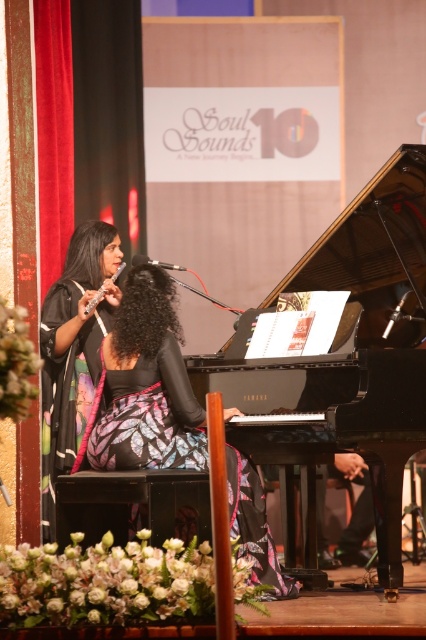
Question: In this image, where is black polished piano at center located relative to matte silver flute at center?

Choices:
 (A) below
 (B) above

Answer: (A)

Question: Which is nearer to the black polished piano at center?

Choices:
 (A) black satin dress at left
 (B) floral dress at center
 (C) matte silver flute at center

Answer: (B)

Question: Is floral dress at center behind matte silver flute at center?

Choices:
 (A) no
 (B) yes

Answer: (A)

Question: Estimate the real-world distances between objects in this image. Which object is closer to the black polished piano at center?

Choices:
 (A) matte silver flute at center
 (B) floral dress at center

Answer: (B)

Question: Can you confirm if black satin dress at left is thinner than matte silver flute at center?

Choices:
 (A) no
 (B) yes

Answer: (A)

Question: Among these objects, which one is nearest to the camera?

Choices:
 (A) black polished piano at center
 (B) black satin dress at left
 (C) matte silver flute at center
 (D) floral dress at center

Answer: (A)